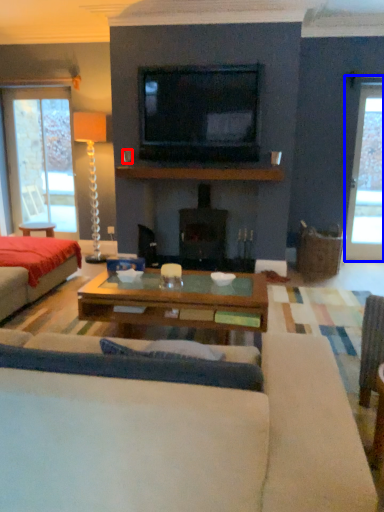
Question: Which object appears closest to the camera in this image, coffee cup (highlighted by a red box) or window (highlighted by a blue box)?

Choices:
 (A) coffee cup
 (B) window

Answer: (A)